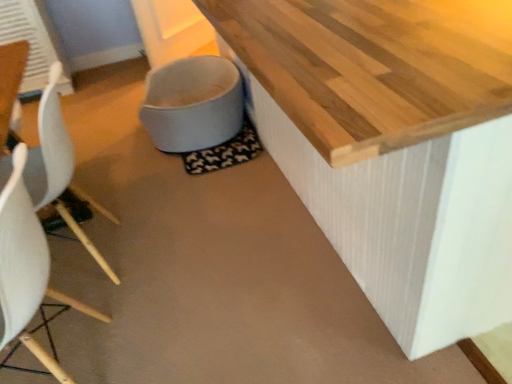
Question: Could you tell me if white plastic chair at left, acting as the 2th chair starting from the front, is facing white fabric toilet bowl at lower center?

Choices:
 (A) no
 (B) yes

Answer: (A)

Question: Is white plastic chair at left, acting as the 2th chair starting from the front, outside white fabric toilet bowl at lower center?

Choices:
 (A) yes
 (B) no

Answer: (A)

Question: Can you confirm if white plastic chair at left, the 1th chair in the back-to-front sequence, is wider than white fabric toilet bowl at lower center?

Choices:
 (A) no
 (B) yes

Answer: (A)

Question: Is white plastic chair at left, the 1th chair in the back-to-front sequence, at the right side of white fabric toilet bowl at lower center?

Choices:
 (A) yes
 (B) no

Answer: (B)

Question: Is white plastic chair at left, the 1th chair in the back-to-front sequence, to the left of white fabric toilet bowl at lower center from the viewer's perspective?

Choices:
 (A) yes
 (B) no

Answer: (A)

Question: Is white matte chair at left, which is the first chair in front-to-back order, inside the boundaries of white plastic chair at left, the 1th chair in the back-to-front sequence, or outside?

Choices:
 (A) outside
 (B) inside

Answer: (A)

Question: In terms of width, does white matte chair at left, which is counted as the 2th chair, starting from the back, look wider or thinner when compared to white plastic chair at left, the 1th chair in the back-to-front sequence?

Choices:
 (A) wide
 (B) thin

Answer: (B)

Question: From the image's perspective, is white matte chair at left, which is counted as the 2th chair, starting from the back, positioned above or below white plastic chair at left, acting as the 2th chair starting from the front?

Choices:
 (A) below
 (B) above

Answer: (A)

Question: In terms of height, does white matte chair at left, which is the first chair in front-to-back order, look taller or shorter compared to white plastic chair at left, the 1th chair in the back-to-front sequence?

Choices:
 (A) tall
 (B) short

Answer: (B)

Question: From the image's perspective, is white matte chair at left, which is the first chair in front-to-back order, located above or below white fabric toilet bowl at lower center?

Choices:
 (A) below
 (B) above

Answer: (A)

Question: From their relative heights in the image, would you say white matte chair at left, which is counted as the 2th chair, starting from the back, is taller or shorter than white fabric toilet bowl at lower center?

Choices:
 (A) tall
 (B) short

Answer: (A)

Question: Does point (25, 344) appear closer or farther from the camera than point (237, 92)?

Choices:
 (A) closer
 (B) farther

Answer: (A)

Question: From a real-world perspective, is white matte chair at left, which is counted as the 2th chair, starting from the back, above or below white fabric toilet bowl at lower center?

Choices:
 (A) below
 (B) above

Answer: (B)

Question: Do you think white fabric toilet bowl at lower center is within white plastic chair at left, the 1th chair in the back-to-front sequence, or outside of it?

Choices:
 (A) outside
 (B) inside

Answer: (A)

Question: From a real-world perspective, is white fabric toilet bowl at lower center positioned above or below white plastic chair at left, the 1th chair in the back-to-front sequence?

Choices:
 (A) above
 (B) below

Answer: (B)